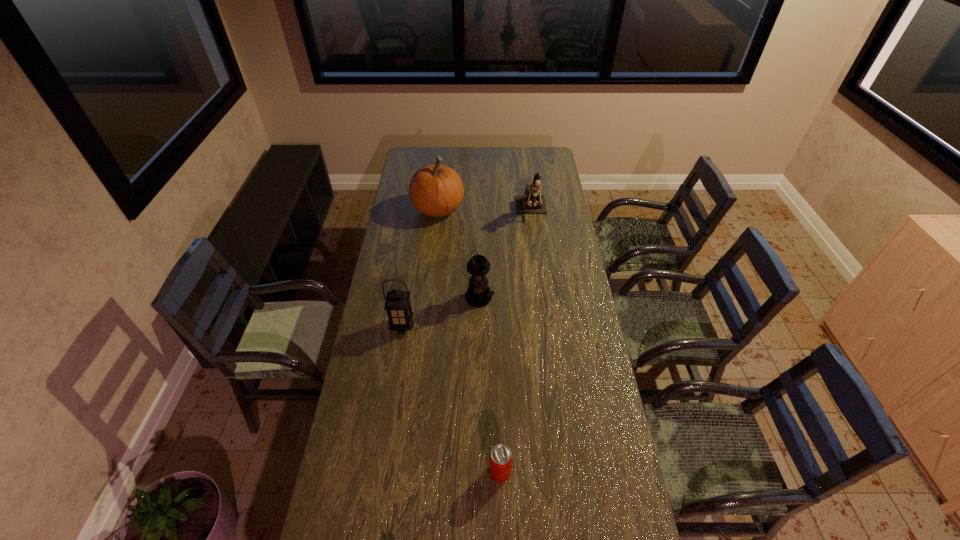
Identify the location of free space in the image that satisfies the following two spatial constraints: 1. on the front-facing side of the rightmost object; 2. above the right lantern, indicating its light source. [x=543, y=298].